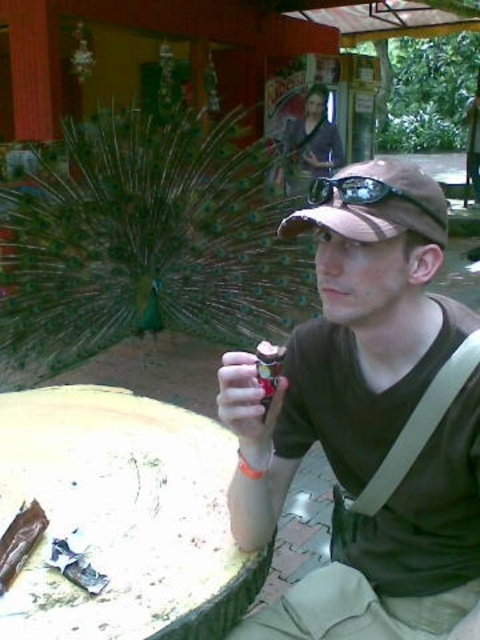
Which is in front, point (278, 449) or point (324, 196)?

Point (324, 196) is more forward.

Does matte brown shirt at center have a smaller size compared to black rubber goggles at center?

No.

Is point (319, 576) less distant than point (324, 184)?

No, (319, 576) is behind (324, 184).

Locate an element on the screen. The height and width of the screenshot is (640, 480). matte brown shirt at center is located at coordinates (369, 419).